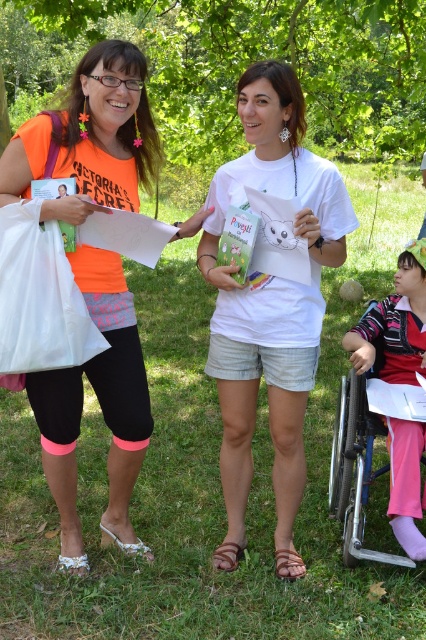
Which is more to the left, white matte t-shirt at center or white fabric bag at left?

white fabric bag at left is more to the left.

Locate an element on the screen. This screenshot has height=640, width=426. white matte t-shirt at center is located at coordinates (270, 305).

Who is more distant from viewer, (273, 74) or (6, 268)?

Positioned behind is point (273, 74).

Where is `white matte t-shirt at center`? Image resolution: width=426 pixels, height=640 pixels. white matte t-shirt at center is located at coordinates (270, 305).

Is white matte t-shirt at center in front of pink fabric pants at lower right?

Yes, it is in front of pink fabric pants at lower right.

At what (x,y) coordinates should I click in order to perform the action: click on white matte t-shirt at center. Please return your answer as a coordinate pair (x, y). Looking at the image, I should click on (270, 305).

Is point (340, 259) positioned after point (402, 531)?

No, (340, 259) is in front of (402, 531).

I want to click on white matte t-shirt at center, so click(x=270, y=305).

Between neon orange fabric at left and white fabric bag at left, which one has less height?

Standing shorter between the two is white fabric bag at left.

In the scene shown: Is the position of neon orange fabric at left more distant than that of white fabric bag at left?

Yes, neon orange fabric at left is further from the viewer.

This screenshot has width=426, height=640. What do you see at coordinates (100, 406) in the screenshot? I see `neon orange fabric at left` at bounding box center [100, 406].

At what (x,y) coordinates should I click in order to perform the action: click on neon orange fabric at left. Please return your answer as a coordinate pair (x, y). This screenshot has width=426, height=640. Looking at the image, I should click on (100, 406).